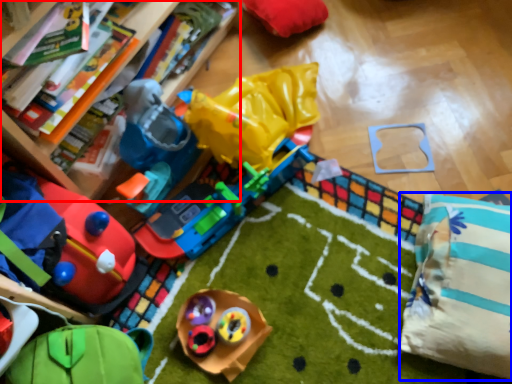
Question: Among these objects, which one is nearest to the camera, bookcase (highlighted by a red box) or pillow (highlighted by a blue box)?

Choices:
 (A) bookcase
 (B) pillow

Answer: (A)